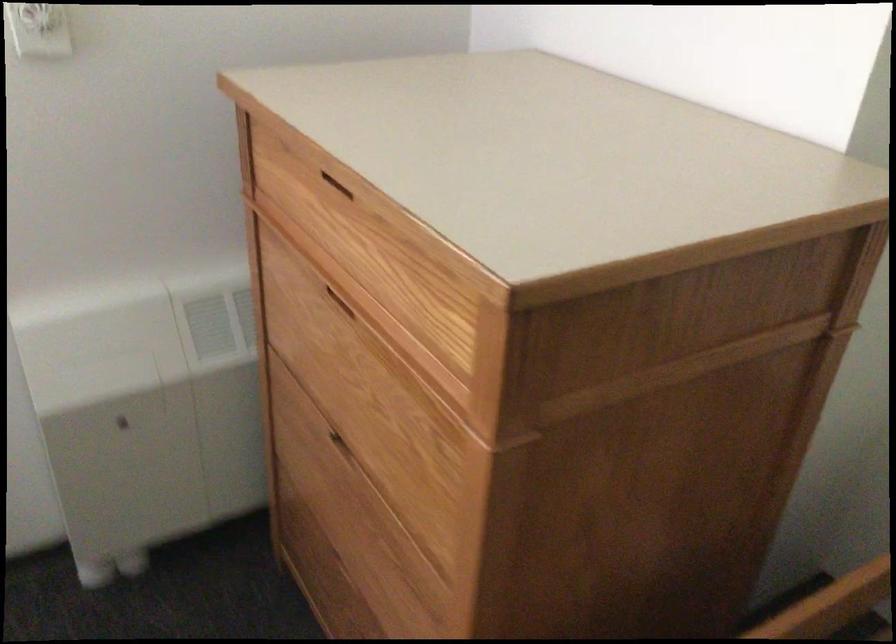
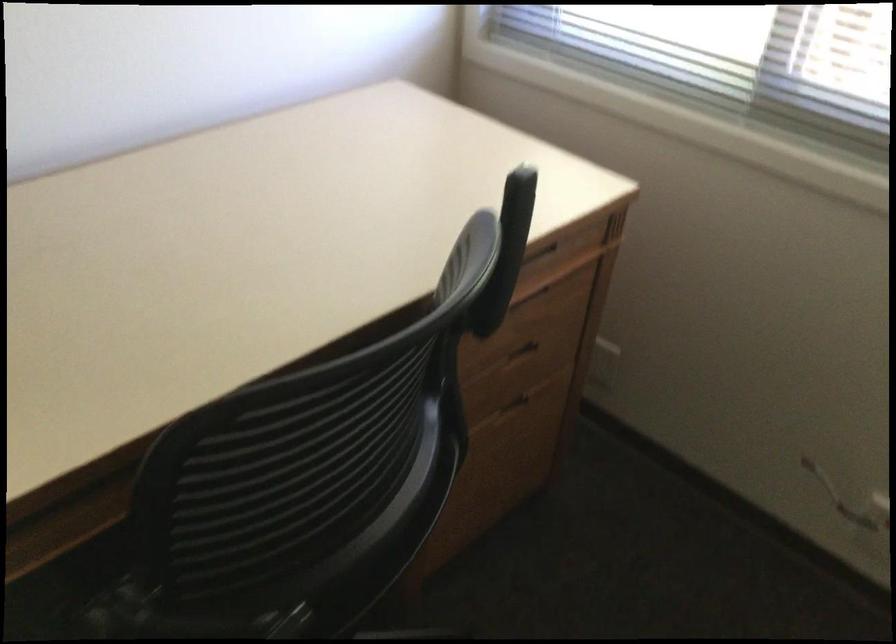
The images are taken continuously from a first-person perspective. In which direction is your viewpoint rotating?

The camera rotated toward left-down.